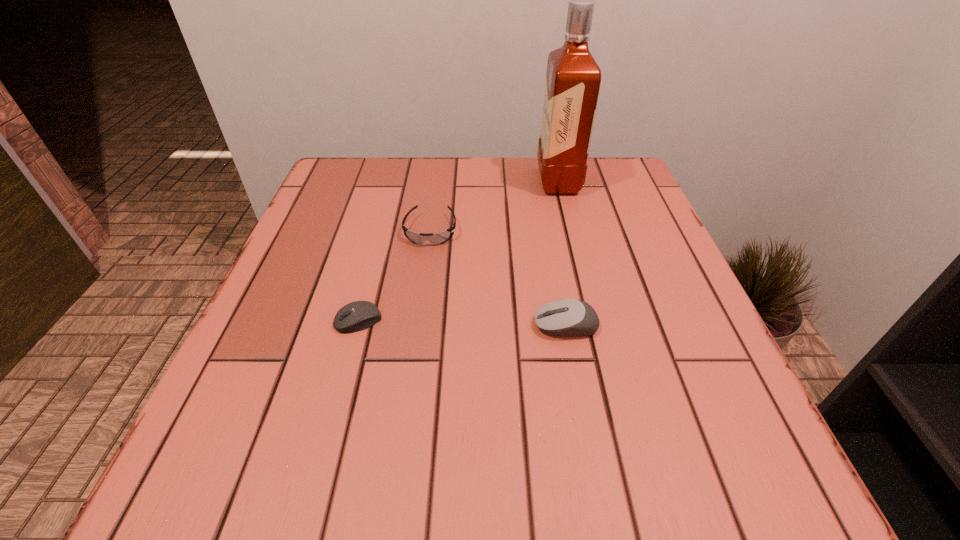
The height and width of the screenshot is (540, 960). What are the coordinates of `vacant space at the far edge` in the screenshot? It's located at (490, 184).

In order to click on vacant space at the near edge in this screenshot , I will do coord(561,481).

This screenshot has height=540, width=960. What are the coordinates of `free space at the left edge of the desktop` in the screenshot? It's located at (227, 426).

I want to click on vacant region at the right edge of the desktop, so click(x=602, y=244).

Where is `vacant space at the far left corner of the desktop`? The height and width of the screenshot is (540, 960). vacant space at the far left corner of the desktop is located at coordinates (364, 186).

You are a GUI agent. You are given a task and a screenshot of the screen. Output one action in this format:
    pyautogui.click(x=<x>, y=<y>)
    Task: Click on the vacant space at the near left corner of the desktop
    This screenshot has height=540, width=960.
    Given the screenshot: What is the action you would take?
    pyautogui.click(x=197, y=507)

Identify the location of vacant region at the far right corner of the desktop. (615, 204).

Find the location of `vacant space at the near right corner of the desktop`. vacant space at the near right corner of the desktop is located at coordinates (727, 449).

Where is `empty location between the sunglasses and the tallest object`? The width and height of the screenshot is (960, 540). empty location between the sunglasses and the tallest object is located at coordinates (494, 206).

Find the location of a particular element. This screenshot has width=960, height=540. unoccupied position between the second farthest object and the liquor is located at coordinates (494, 206).